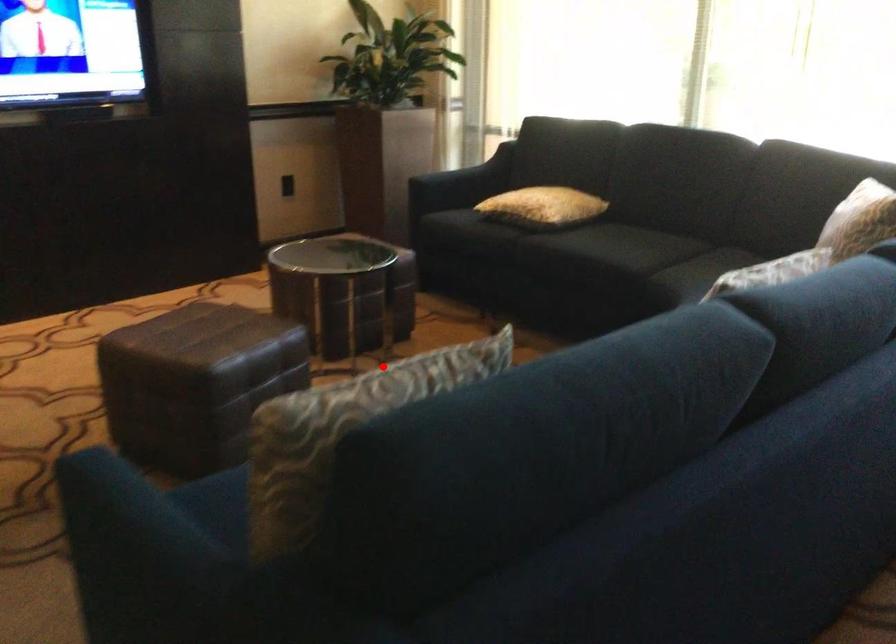
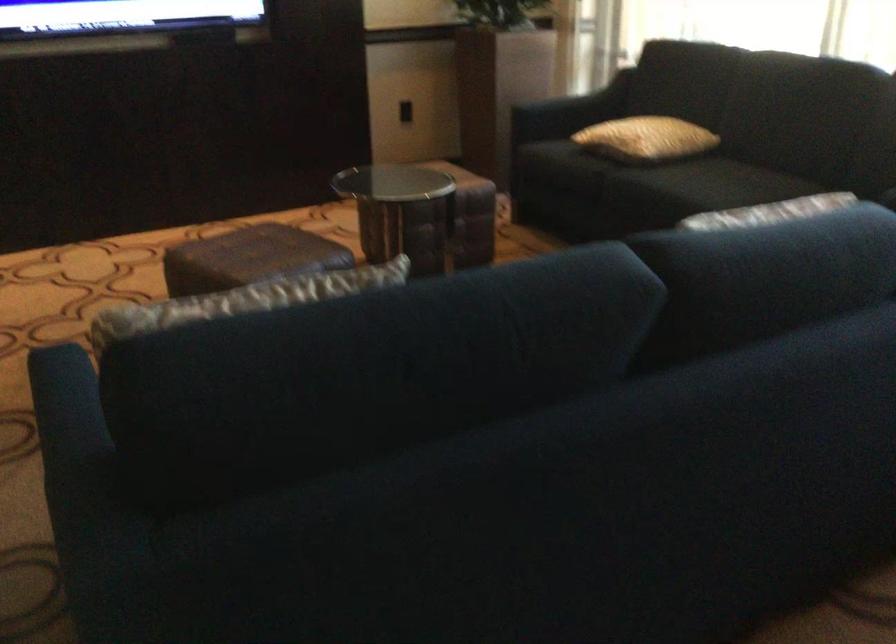
Where in the second image is the point corresponding to the highlighted location from the first image?

(252, 298)